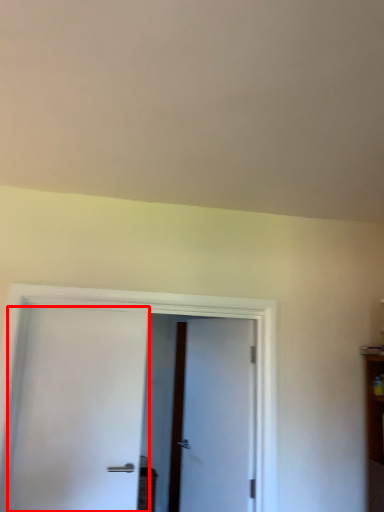
Question: From the image's perspective, considering the relative positions of door (annotated by the red box) and door in the image provided, where is door (annotated by the red box) located with respect to the staircase?

Choices:
 (A) below
 (B) above

Answer: (B)